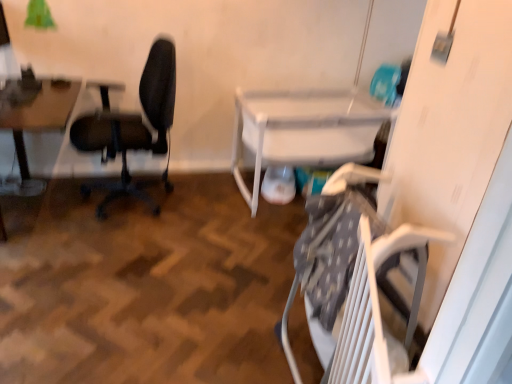
Question: Does white plastic table at lower right, which is counted as the first table, starting from the right, have a lesser width compared to black matte office chair at left?

Choices:
 (A) no
 (B) yes

Answer: (A)

Question: Can you confirm if white plastic table at lower right, which is counted as the first table, starting from the right, is smaller than black matte office chair at left?

Choices:
 (A) yes
 (B) no

Answer: (B)

Question: Is white plastic table at lower right, which appears as the 2th table when viewed from the left, closer to the viewer compared to black matte office chair at left?

Choices:
 (A) yes
 (B) no

Answer: (B)

Question: From a real-world perspective, does white plastic table at lower right, which appears as the 2th table when viewed from the left, sit lower than black matte office chair at left?

Choices:
 (A) yes
 (B) no

Answer: (A)

Question: Is white plastic table at lower right, which appears as the 2th table when viewed from the left, facing towards black matte office chair at left?

Choices:
 (A) yes
 (B) no

Answer: (B)

Question: Is white plastic table at lower right, which appears as the 2th table when viewed from the left, at the left side of black matte office chair at left?

Choices:
 (A) yes
 (B) no

Answer: (B)

Question: Is the surface of white plastic table at lower right, which appears as the 2th table when viewed from the left, in direct contact with wooden table at left, arranged as the first table when viewed from the left?

Choices:
 (A) no
 (B) yes

Answer: (A)

Question: Is white plastic table at lower right, which appears as the 2th table when viewed from the left, oriented towards wooden table at left, arranged as the first table when viewed from the left?

Choices:
 (A) yes
 (B) no

Answer: (B)

Question: Is white plastic table at lower right, which is counted as the first table, starting from the right, at the right side of wooden table at left, arranged as the first table when viewed from the left?

Choices:
 (A) no
 (B) yes

Answer: (B)

Question: Is white plastic table at lower right, which is counted as the first table, starting from the right, outside of wooden table at left, which appears as the 2th table when viewed from the right?

Choices:
 (A) yes
 (B) no

Answer: (A)

Question: Is white plastic table at lower right, which appears as the 2th table when viewed from the left, closer to the viewer compared to wooden table at left, which appears as the 2th table when viewed from the right?

Choices:
 (A) no
 (B) yes

Answer: (A)

Question: Is wooden table at left, which appears as the 2th table when viewed from the right, at the back of white plastic table at lower right, which is counted as the first table, starting from the right?

Choices:
 (A) no
 (B) yes

Answer: (A)

Question: From the image's perspective, is wooden table at left, which appears as the 2th table when viewed from the right, on white plastic table at lower right, which is counted as the first table, starting from the right?

Choices:
 (A) yes
 (B) no

Answer: (B)